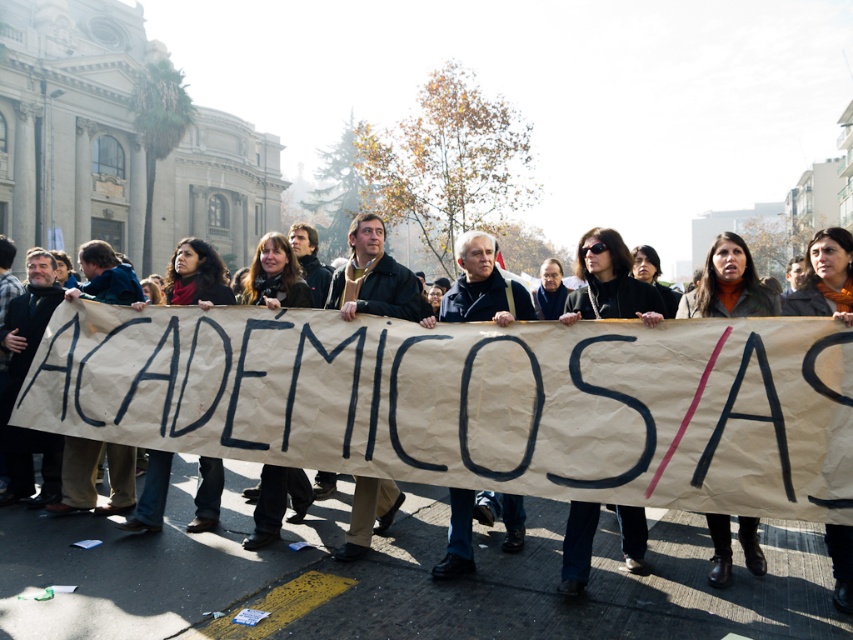
You are a photographer at the protest scene. You need to capture a photo of both the matte black sunglasses at center and the dark gray sweater at center. Based on their positions, which object should you focus on first to ensure both are in frame?

The dark gray sweater at center should be focused on first since the matte black sunglasses at center is to the right of it, ensuring both are within the frame when starting from the left.

You are a photographer standing at the back of the protest group. You want to take a closeup photo of the dark brown leather jacket at center without moving closer. Can you do it with a standard zoom lens that has a maximum zoom of 200mm?

The dark brown leather jacket at center is 3.72 meters away from the viewer. With a standard zoom lens up to 200mm, you can achieve sufficient magnification to capture a closeup of the dark brown leather jacket at center from that distance.